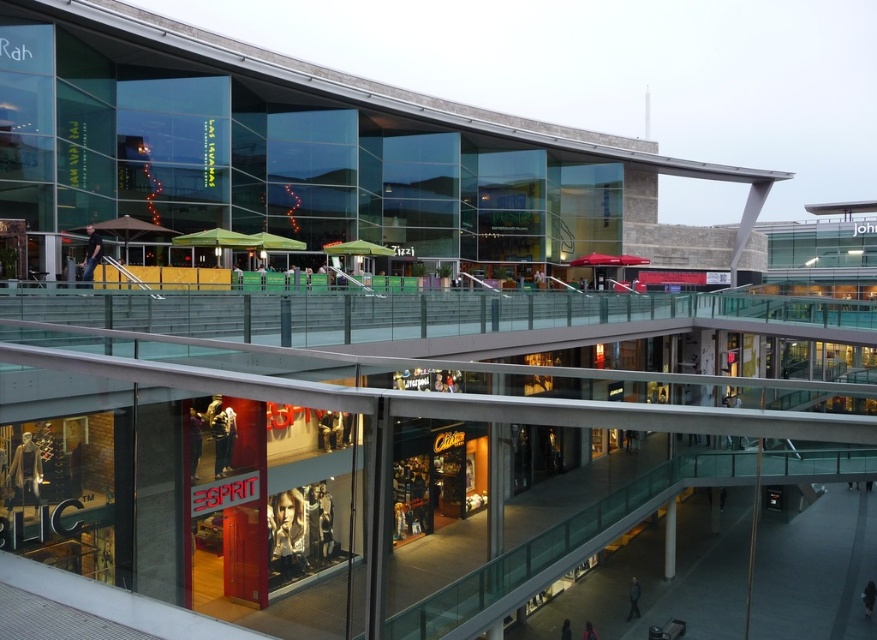
Can you confirm if metallic silver poster at center is thinner than dark blue jeans at lower left?

In fact, metallic silver poster at center might be wider than dark blue jeans at lower left.

Is metallic silver poster at center positioned at the back of dark blue jeans at lower left?

No.

What do you see at coordinates (286, 532) in the screenshot? Image resolution: width=877 pixels, height=640 pixels. I see `metallic silver poster at center` at bounding box center [286, 532].

Locate an element on the screen. Image resolution: width=877 pixels, height=640 pixels. metallic silver poster at center is located at coordinates (286, 532).

Between metallic silver poster at center and matte brown leather jacket at lower left, which one appears on the right side from the viewer's perspective?

Positioned to the right is matte brown leather jacket at lower left.

Who is lower down, metallic silver poster at center or matte brown leather jacket at lower left?

Positioned lower is metallic silver poster at center.

Is point (289, 538) more distant than point (22, 474)?

Yes, point (289, 538) is farther from viewer.

At what (x,y) coordinates should I click in order to perform the action: click on metallic silver poster at center. Please return your answer as a coordinate pair (x, y). This screenshot has width=877, height=640. Looking at the image, I should click on (286, 532).

Does dark blue jeans at lower left appear on the left side of dark blue jeans at lower center?

Yes, dark blue jeans at lower left is to the left of dark blue jeans at lower center.

Looking at this image, between dark blue jeans at lower left and dark blue jeans at lower center, which one is positioned lower?

dark blue jeans at lower center is lower down.

What do you see at coordinates (91, 253) in the screenshot? I see `dark blue jeans at lower left` at bounding box center [91, 253].

The width and height of the screenshot is (877, 640). I want to click on dark blue jeans at lower left, so (91, 253).